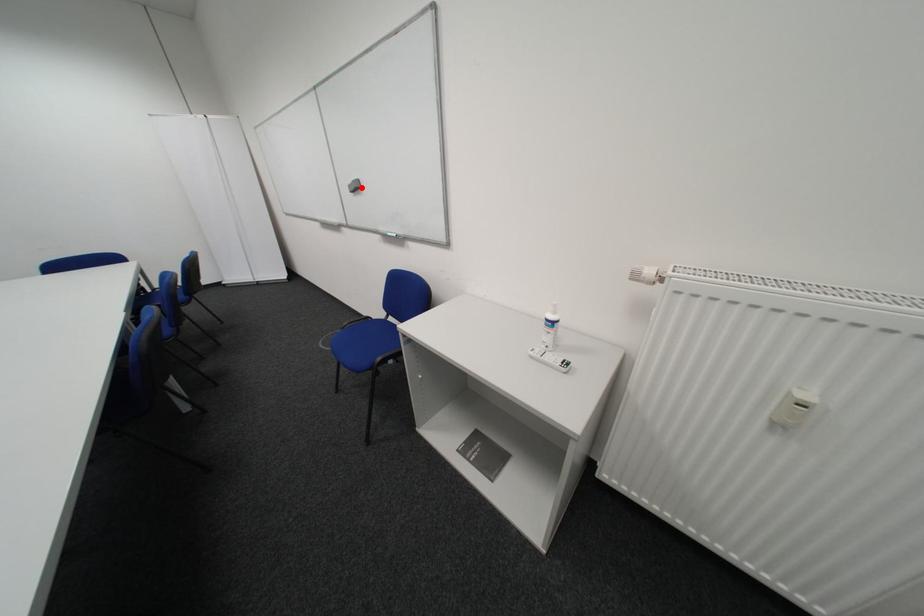
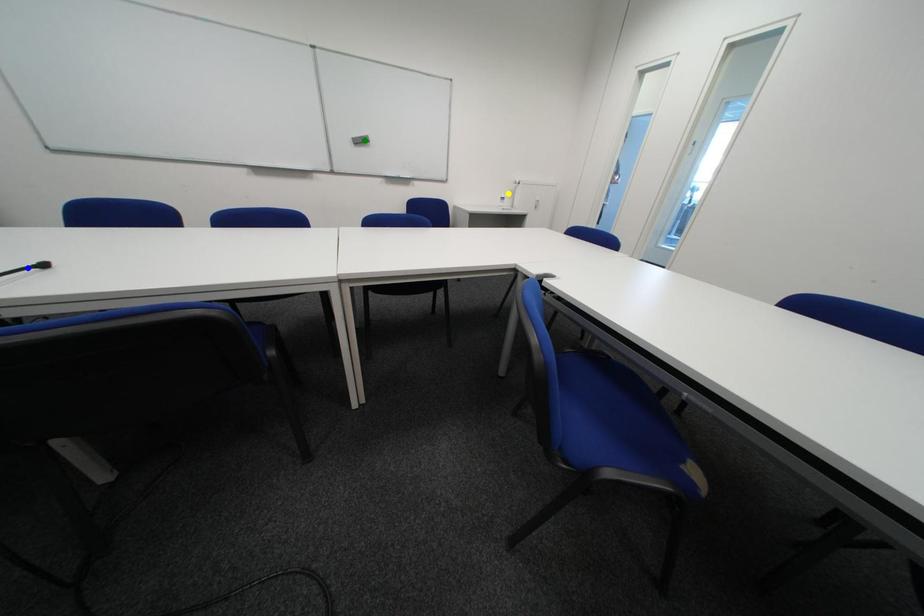
Question: I am providing you with two images of the same scene from different viewpoints. A red point is marked on the first image. You are given multiple points on the second image. In image 2, which mark is for the same physical point as the one in image 1?

Choices:
 (A) yellow point
 (B) green point
 (C) blue point

Answer: (B)